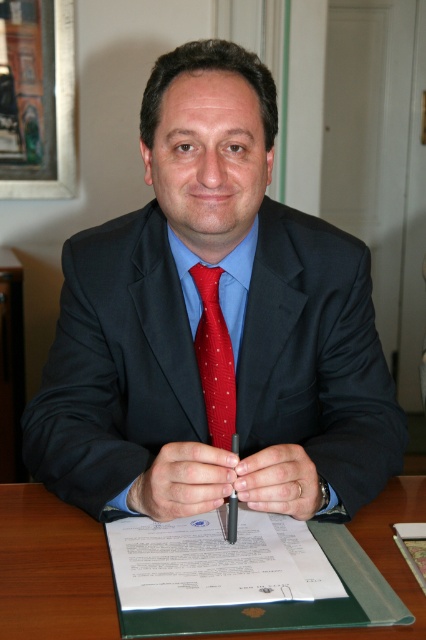
Is white paper at center in front of red dotted fabric tie at center?

Yes.

The image size is (426, 640). What do you see at coordinates (218, 561) in the screenshot? I see `white paper at center` at bounding box center [218, 561].

Is point (135, 609) farther from camera compared to point (227, 372)?

No, (135, 609) is in front of (227, 372).

Find the location of `white paper at center`. white paper at center is located at coordinates (218, 561).

Based on the photo, who is shorter, white paper at center or metallic red pen at center?

With less height is white paper at center.

Is white paper at center thinner than metallic red pen at center?

No.

At what (x,y) coordinates should I click in order to perform the action: click on white paper at center. Please return your answer as a coordinate pair (x, y). Looking at the image, I should click on (218, 561).

How far apart are green leather folder at center and metallic red pen at center?

green leather folder at center and metallic red pen at center are 9.19 inches apart.

Can you confirm if green leather folder at center is positioned above metallic red pen at center?

No, green leather folder at center is not above metallic red pen at center.

Is point (17, 632) more distant than point (230, 540)?

No, it is in front of (230, 540).

Where is `green leather folder at center`? This screenshot has width=426, height=640. green leather folder at center is located at coordinates (52, 570).